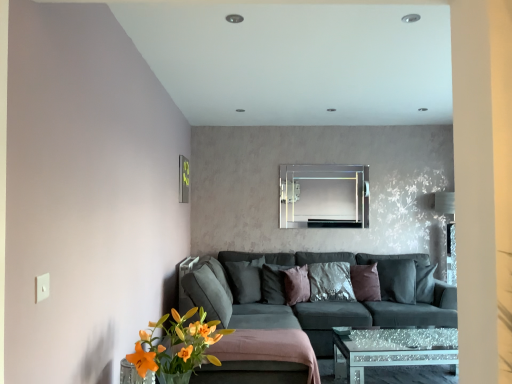
Question: From the image's perspective, is shiny metallic pillow at center, which appears as the first pillow when viewed from the right, beneath clear glass mirror at center?

Choices:
 (A) yes
 (B) no

Answer: (A)

Question: Is shiny metallic pillow at center, which appears as the first pillow when viewed from the right, bigger than clear glass mirror at center?

Choices:
 (A) yes
 (B) no

Answer: (A)

Question: Is shiny metallic pillow at center, placed as the 4th pillow when sorted from left to right, oriented away from clear glass mirror at center?

Choices:
 (A) no
 (B) yes

Answer: (A)

Question: Does shiny metallic pillow at center, which appears as the first pillow when viewed from the right, have a smaller size compared to clear glass mirror at center?

Choices:
 (A) no
 (B) yes

Answer: (A)

Question: Can you see shiny metallic pillow at center, placed as the 4th pillow when sorted from left to right, touching clear glass mirror at center?

Choices:
 (A) no
 (B) yes

Answer: (A)

Question: Is the position of shiny metallic pillow at center, which appears as the first pillow when viewed from the right, less distant than that of clear glass mirror at center?

Choices:
 (A) yes
 (B) no

Answer: (A)

Question: Is shiny metallic pillow at center, placed as the 4th pillow when sorted from left to right, in front of dark gray fabric pillow at center, which appears as the fourth pillow when viewed from the right?

Choices:
 (A) no
 (B) yes

Answer: (A)

Question: From a real-world perspective, does shiny metallic pillow at center, placed as the 4th pillow when sorted from left to right, stand above dark gray fabric pillow at center, arranged as the first pillow when viewed from the left?

Choices:
 (A) no
 (B) yes

Answer: (A)

Question: Can dark gray fabric pillow at center, which appears as the fourth pillow when viewed from the right, be found inside shiny metallic pillow at center, which appears as the first pillow when viewed from the right?

Choices:
 (A) yes
 (B) no

Answer: (B)

Question: Does shiny metallic pillow at center, which appears as the first pillow when viewed from the right, have a lesser width compared to dark gray fabric pillow at center, which appears as the fourth pillow when viewed from the right?

Choices:
 (A) no
 (B) yes

Answer: (B)

Question: Does shiny metallic pillow at center, placed as the 4th pillow when sorted from left to right, have a lesser height compared to dark gray fabric pillow at center, arranged as the first pillow when viewed from the left?

Choices:
 (A) no
 (B) yes

Answer: (B)

Question: Is shiny metallic pillow at center, which appears as the first pillow when viewed from the right, smaller than dark gray fabric pillow at center, which appears as the fourth pillow when viewed from the right?

Choices:
 (A) yes
 (B) no

Answer: (A)

Question: Is metallic rectangular frame at upper left bigger than clear glass mirror at center?

Choices:
 (A) yes
 (B) no

Answer: (B)